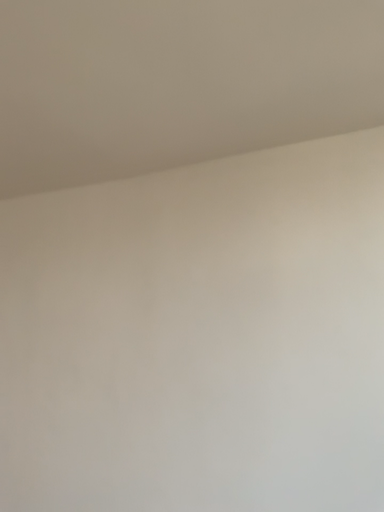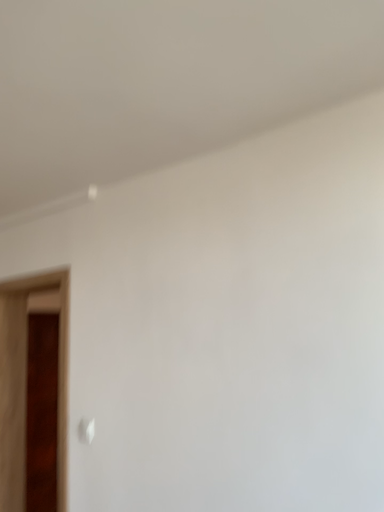
Question: How did the camera likely rotate when shooting the video?

Choices:
 (A) rotated right
 (B) rotated left

Answer: (B)